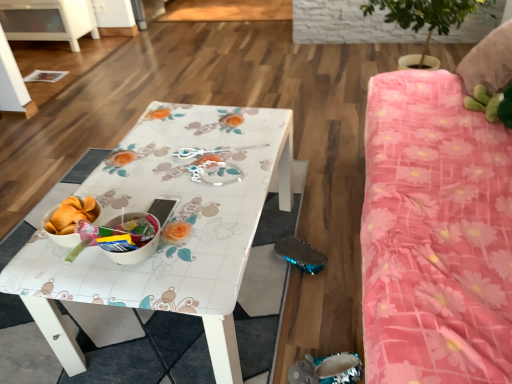
Question: Considering the relative sizes of clear plastic spoon at center and pink floral fabric bed at right in the image provided, is clear plastic spoon at center bigger than pink floral fabric bed at right?

Choices:
 (A) no
 (B) yes

Answer: (A)

Question: Does clear plastic spoon at center have a lesser height compared to pink floral fabric bed at right?

Choices:
 (A) yes
 (B) no

Answer: (A)

Question: Does clear plastic spoon at center have a smaller size compared to pink floral fabric bed at right?

Choices:
 (A) no
 (B) yes

Answer: (B)

Question: Is clear plastic spoon at center positioned with its back to pink floral fabric bed at right?

Choices:
 (A) no
 (B) yes

Answer: (A)

Question: Would you consider clear plastic spoon at center to be distant from pink floral fabric bed at right?

Choices:
 (A) yes
 (B) no

Answer: (B)

Question: Is clear plastic spoon at center next to pink floral fabric bed at right and touching it?

Choices:
 (A) no
 (B) yes

Answer: (A)

Question: Could you tell me if pink floral fabric bed at right is facing clear plastic spoon at center?

Choices:
 (A) yes
 (B) no

Answer: (A)

Question: Considering the relative positions of pink floral fabric bed at right and clear plastic spoon at center in the image provided, is pink floral fabric bed at right to the right of clear plastic spoon at center from the viewer's perspective?

Choices:
 (A) no
 (B) yes

Answer: (B)

Question: Can you confirm if pink floral fabric bed at right is shorter than clear plastic spoon at center?

Choices:
 (A) yes
 (B) no

Answer: (B)

Question: Is pink floral fabric bed at right wider than clear plastic spoon at center?

Choices:
 (A) no
 (B) yes

Answer: (B)

Question: From the image's perspective, does pink floral fabric bed at right appear lower than clear plastic spoon at center?

Choices:
 (A) no
 (B) yes

Answer: (B)

Question: Would you say pink floral fabric bed at right is outside clear plastic spoon at center?

Choices:
 (A) no
 (B) yes

Answer: (B)

Question: Can you confirm if pink floral fabric bed at right is smaller than white glossy table at center?

Choices:
 (A) no
 (B) yes

Answer: (A)